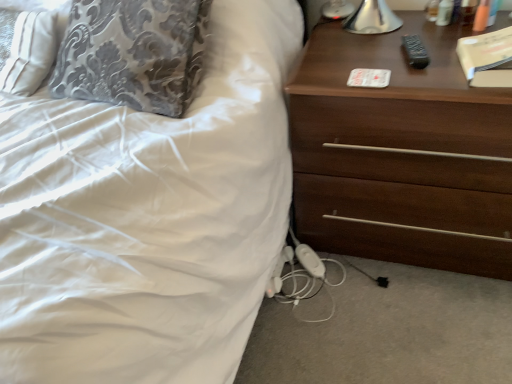
Locate an element on the screen. Image resolution: width=512 pixels, height=384 pixels. unoccupied space behind beige matte book at upper right is located at coordinates (433, 49).